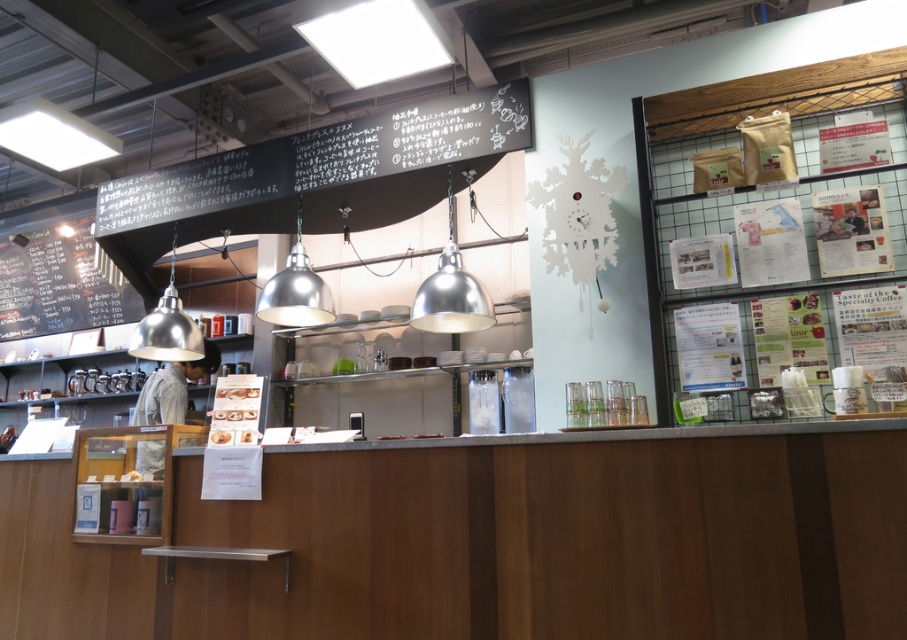
Between black chalkboard menu at upper center and black chalkboard menu at left, which one has less height?

With less height is black chalkboard menu at upper center.

Who is positioned more to the left, black chalkboard menu at upper center or black chalkboard menu at left?

black chalkboard menu at left is more to the left.

Between point (491, 138) and point (41, 323), which one is positioned behind?

The point (41, 323) is behind.

At what (x,y) coordinates should I click in order to perform the action: click on black chalkboard menu at upper center. Please return your answer as a coordinate pair (x, y). This screenshot has width=907, height=640. Looking at the image, I should click on (324, 172).